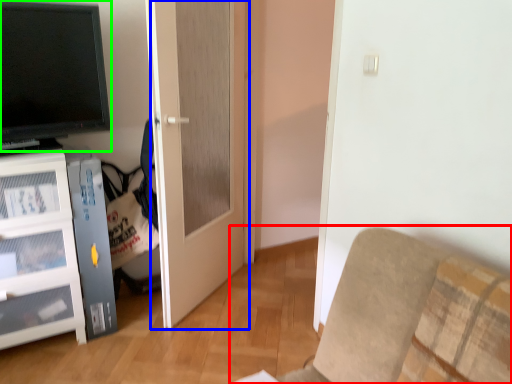
Question: Which object is the farthest from furniture (highlighted by a red box)? Choose among these: door (highlighted by a blue box) or television (highlighted by a green box).

Choices:
 (A) door
 (B) television

Answer: (B)